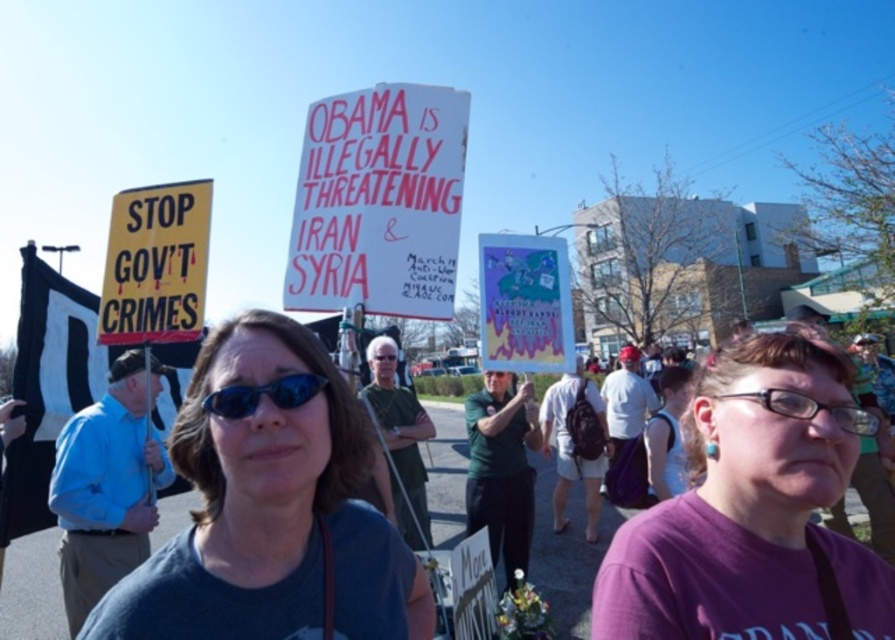
Measure the distance between gray fabric shirt at center and pink paper sign at center.

The distance of gray fabric shirt at center from pink paper sign at center is 4.31 feet.

Who is lower down, gray fabric shirt at center or pink paper sign at center?

gray fabric shirt at center is below.

Locate an element on the screen. This screenshot has width=895, height=640. gray fabric shirt at center is located at coordinates point(269,506).

Can you confirm if yellow paper sign at left is positioned to the left of sunglasses at center?

Yes, yellow paper sign at left is to the left of sunglasses at center.

Which is in front, point (200, 316) or point (311, 396)?

Point (311, 396) is more forward.

Is point (150, 308) closer to camera compared to point (227, 394)?

No, it is not.

You are a GUI agent. You are given a task and a screenshot of the screen. Output one action in this format:
    pyautogui.click(x=<x>, y=<y>)
    Task: Click on the yellow paper sign at left
    
    Given the screenshot: What is the action you would take?
    pyautogui.click(x=155, y=262)

Can you confirm if gray fabric shirt at center is taller than purple fabric shirt at center?

Correct, gray fabric shirt at center is much taller as purple fabric shirt at center.

Does gray fabric shirt at center have a smaller size compared to purple fabric shirt at center?

No, gray fabric shirt at center is not smaller than purple fabric shirt at center.

The height and width of the screenshot is (640, 895). Describe the element at coordinates (269, 506) in the screenshot. I see `gray fabric shirt at center` at that location.

Locate an element on the screen. gray fabric shirt at center is located at coordinates (269, 506).